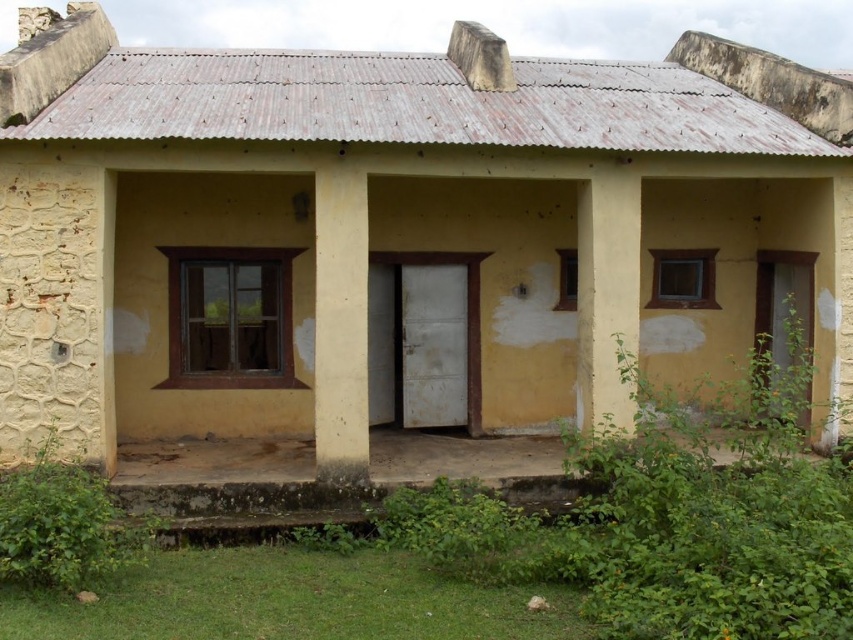
Question: Is white smooth pillar at center below yellow matte pillar at center?

Choices:
 (A) no
 (B) yes

Answer: (B)

Question: Can you confirm if white smooth pillar at center is smaller than yellow matte pillar at center?

Choices:
 (A) yes
 (B) no

Answer: (A)

Question: Which point is closer to the camera taking this photo?

Choices:
 (A) (366, 296)
 (B) (596, 284)

Answer: (A)

Question: Is white smooth pillar at center wider than yellow matte pillar at center?

Choices:
 (A) yes
 (B) no

Answer: (B)

Question: Which of the following is the closest to the observer?

Choices:
 (A) (627, 253)
 (B) (357, 342)

Answer: (B)